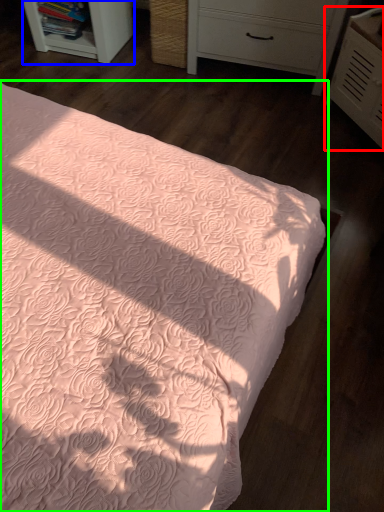
Question: Based on their relative distances, which object is nearer to chest of drawers (highlighted by a red box)? Choose from shelf (highlighted by a blue box) and bed (highlighted by a green box).

Choices:
 (A) shelf
 (B) bed

Answer: (B)